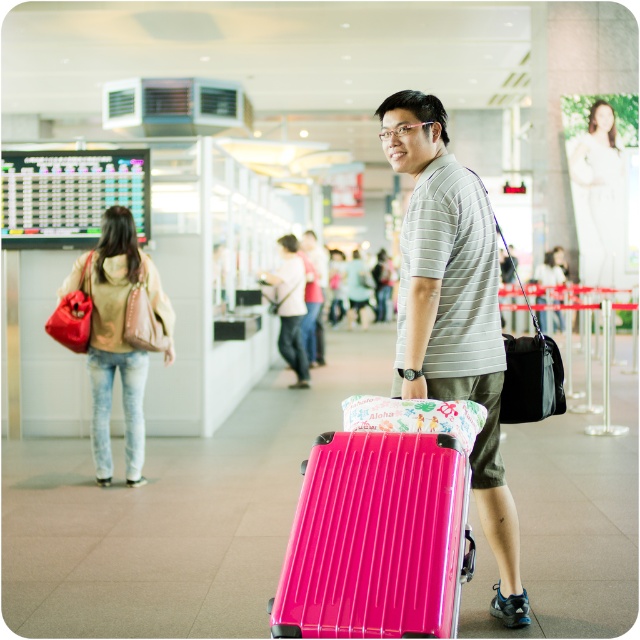
Who is positioned more to the left, matte beige hoodie at left or white matte dress at upper right?

Positioned to the left is matte beige hoodie at left.

Who is shorter, matte beige hoodie at left or white matte dress at upper right?

matte beige hoodie at left

Between point (128, 230) and point (582, 182), which one is positioned in front?

Positioned in front is point (128, 230).

You are a GUI agent. You are given a task and a screenshot of the screen. Output one action in this format:
    pyautogui.click(x=<x>, y=<y>)
    Task: Click on the matte beige hoodie at left
    
    Given the screenshot: What is the action you would take?
    pyautogui.click(x=118, y=337)

Is glossy plastic suitcase at lower center shorter than white matte dress at upper right?

Yes.

Based on the photo, who is shorter, glossy plastic suitcase at lower center or white matte dress at upper right?

Standing shorter between the two is glossy plastic suitcase at lower center.

Between point (440, 556) and point (570, 144), which one is positioned behind?

The point (570, 144) is behind.

Where is `glossy plastic suitcase at lower center`? This screenshot has height=640, width=640. glossy plastic suitcase at lower center is located at coordinates (376, 538).

Does point (166, 328) lie in front of point (292, 300)?

Yes, it is in front of point (292, 300).

Based on the photo, does matte beige hoodie at left have a smaller size compared to matte beige jacket at center?

Yes, matte beige hoodie at left is smaller than matte beige jacket at center.

Between point (168, 304) and point (298, 244), which one is positioned behind?

The point (298, 244) is more distant.

Find the location of `matte beige hoodie at left`. matte beige hoodie at left is located at coordinates pyautogui.click(x=118, y=337).